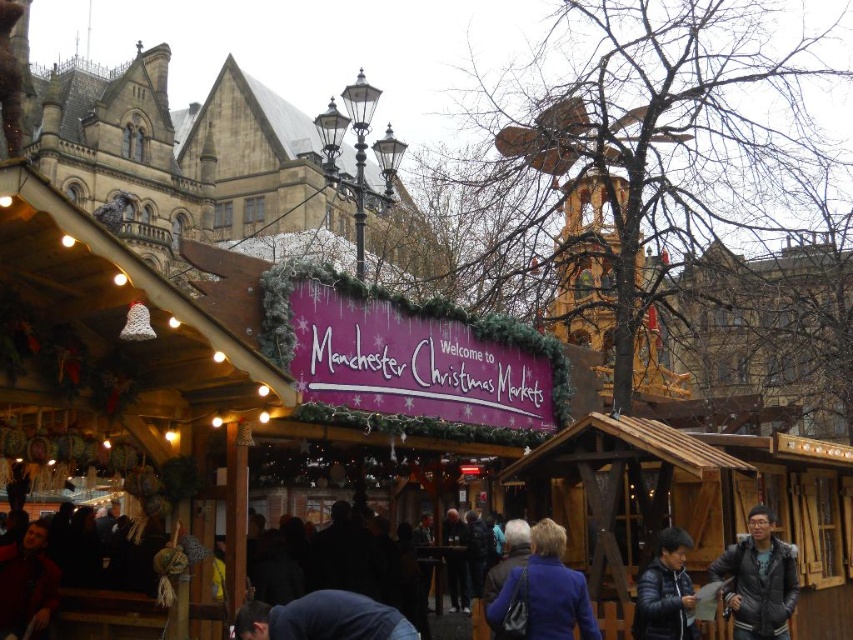
Does dark gray puffer jacket at lower right have a lesser height compared to black leather jacket at lower center?

Incorrect, dark gray puffer jacket at lower right's height does not fall short of black leather jacket at lower center's.

Can you confirm if dark gray puffer jacket at lower right is taller than black leather jacket at lower center?

Correct, dark gray puffer jacket at lower right is much taller as black leather jacket at lower center.

This screenshot has height=640, width=853. I want to click on dark gray puffer jacket at lower right, so click(758, 580).

Identify the location of dark gray puffer jacket at lower right. (758, 580).

Is matte blue coat at center to the right of dark gray puffer jacket at lower right from the viewer's perspective?

In fact, matte blue coat at center is to the left of dark gray puffer jacket at lower right.

This screenshot has height=640, width=853. Find the location of `matte blue coat at center`. matte blue coat at center is located at coordinates (543, 593).

Does matte blue coat at center appear under dark brown leather jacket at lower left?

No.

Between matte blue coat at center and dark brown leather jacket at lower left, which one is positioned higher?

matte blue coat at center

What do you see at coordinates (543, 593) in the screenshot?
I see `matte blue coat at center` at bounding box center [543, 593].

Where is `matte blue coat at center`? matte blue coat at center is located at coordinates coord(543,593).